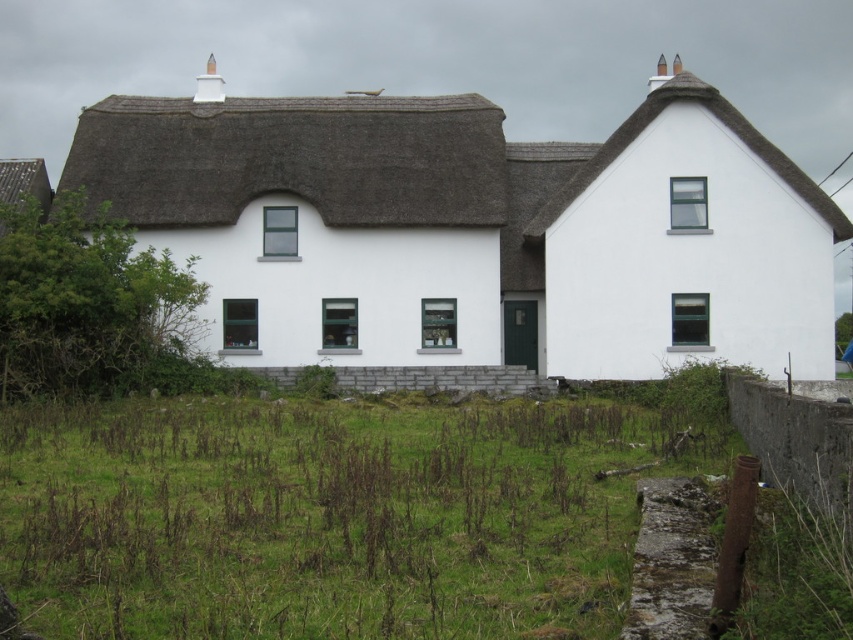
Between white thatched roof cottage at center and thatched roof at upper right, which one is positioned higher?

thatched roof at upper right is above.

You are a GUI agent. You are given a task and a screenshot of the screen. Output one action in this format:
    pyautogui.click(x=<x>, y=<y>)
    Task: Click on the white thatched roof cottage at center
    
    Given the screenshot: What is the action you would take?
    pyautogui.click(x=474, y=228)

Between green grass at lower center and thatched roof at upper right, which one appears on the right side from the viewer's perspective?

Positioned to the right is thatched roof at upper right.

Is green grass at lower center positioned at the back of thatched roof at upper right?

That is False.

Is point (149, 436) closer to viewer compared to point (770, 170)?

Yes, it is.

Identify the location of green grass at lower center. (318, 518).

Does white thatched roof cottage at center have a greater height compared to green grass at lower center?

Indeed, white thatched roof cottage at center has a greater height compared to green grass at lower center.

The image size is (853, 640). Identify the location of white thatched roof cottage at center. (474, 228).

Find the location of a particular element. The image size is (853, 640). white thatched roof cottage at center is located at coordinates (474, 228).